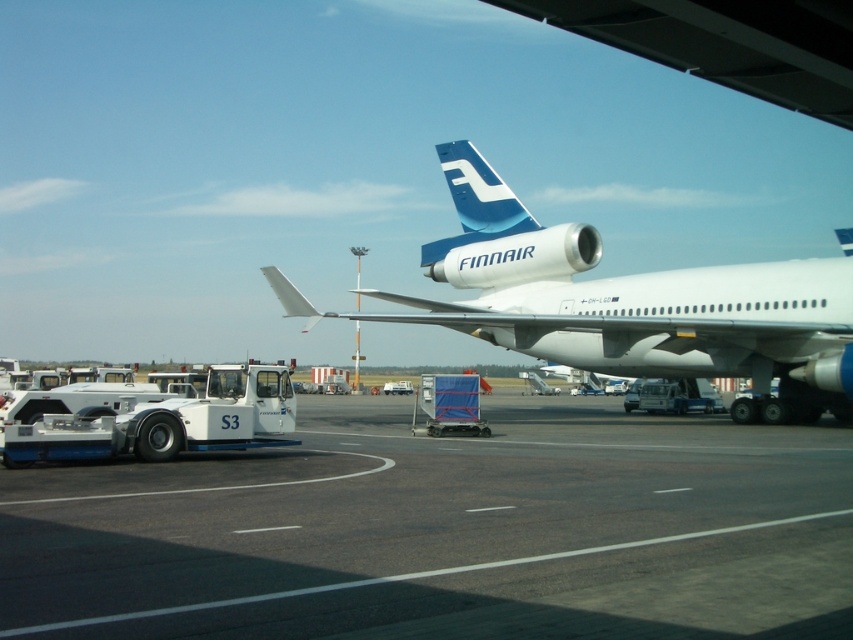
Question: Is black asphalt tarmac at center bigger than blue glossy finnair tail at upper center?

Choices:
 (A) yes
 (B) no

Answer: (B)

Question: Is black asphalt tarmac at center behind blue glossy finnair tail at upper center?

Choices:
 (A) yes
 (B) no

Answer: (B)

Question: Which object is the closest to the blue glossy finnair tail at upper center?

Choices:
 (A) white glossy airplane at center
 (B) black asphalt tarmac at center

Answer: (A)

Question: Which of the following is the closest to the observer?

Choices:
 (A) blue glossy finnair tail at upper center
 (B) white glossy airplane at center
 (C) black asphalt tarmac at center

Answer: (C)

Question: Can you confirm if black asphalt tarmac at center is positioned below blue glossy finnair tail at upper center?

Choices:
 (A) no
 (B) yes

Answer: (B)

Question: Which of the following is the closest to the observer?

Choices:
 (A) white glossy airplane at center
 (B) black asphalt tarmac at center
 (C) blue glossy finnair tail at upper center

Answer: (B)